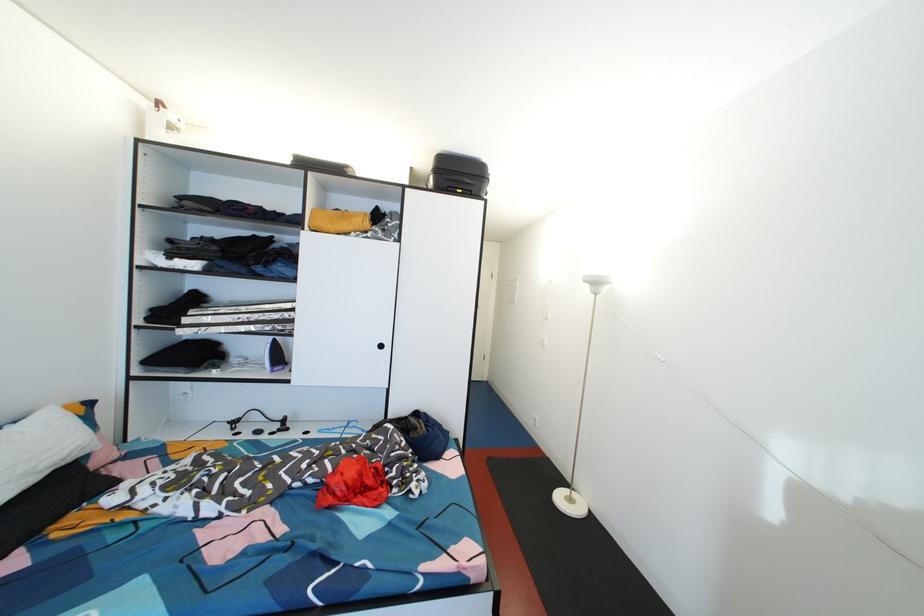
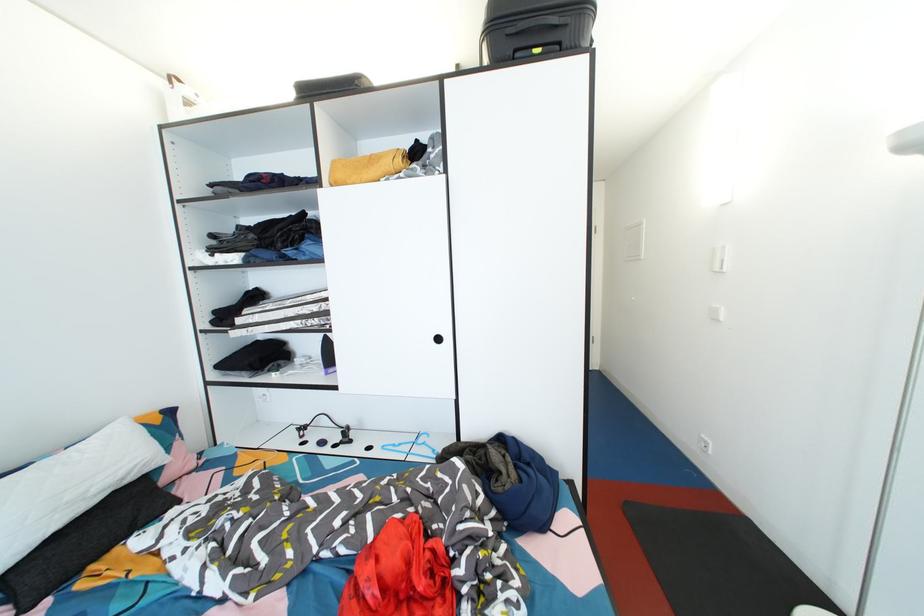
Question: The camera is either moving clockwise (left) or counter-clockwise (right) around the object. The first image is from the beginning of the video and the second image is from the end. Is the camera moving left or right when shooting the video?

Choices:
 (A) Left
 (B) Right

Answer: (B)